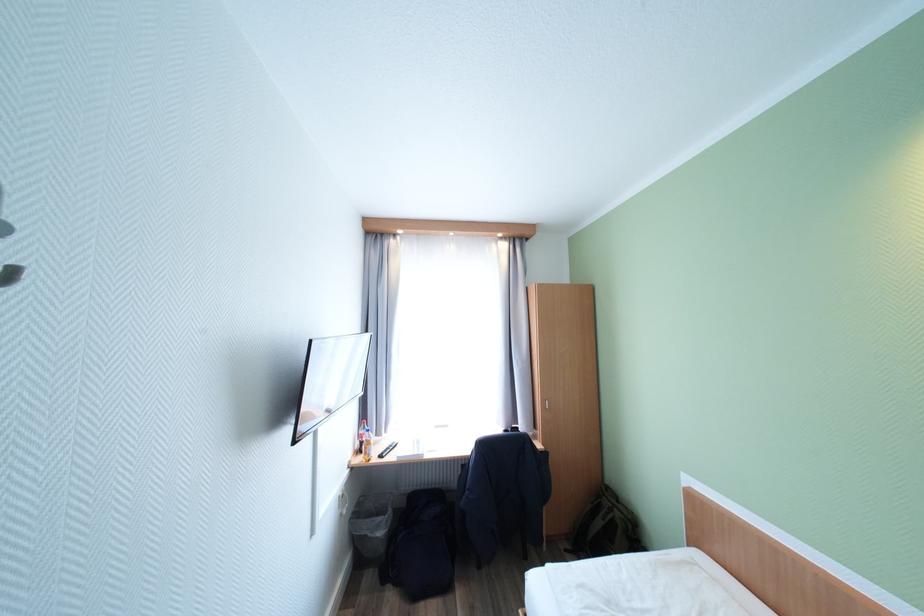
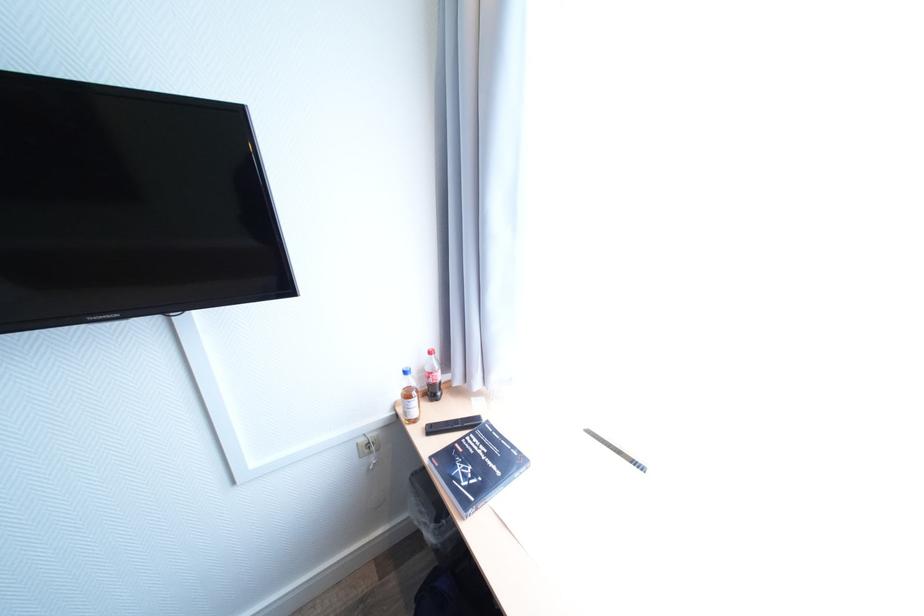
Locate, in the second image, the point that corresponds to (x=346, y=498) in the first image.

(365, 445)